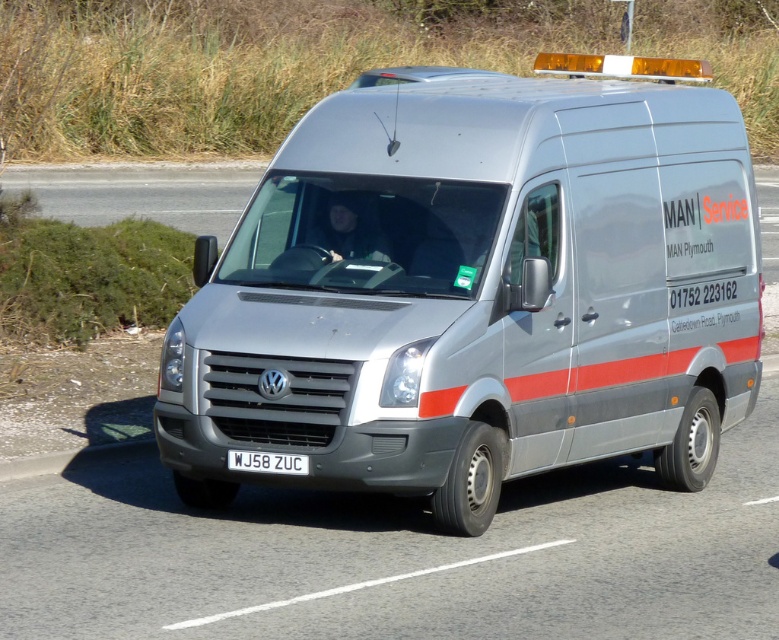
Question: Which point appears farthest from the camera in this image?

Choices:
 (A) (266, 465)
 (B) (566, 362)

Answer: (B)

Question: Can you confirm if satin silver van at center is thinner than white plastic license plate at center?

Choices:
 (A) no
 (B) yes

Answer: (A)

Question: Which point is closer to the camera taking this photo?

Choices:
 (A) (534, 433)
 (B) (273, 468)

Answer: (B)

Question: Is the position of satin silver van at center more distant than that of white plastic license plate at center?

Choices:
 (A) no
 (B) yes

Answer: (B)

Question: Can you confirm if satin silver van at center is wider than white plastic license plate at center?

Choices:
 (A) no
 (B) yes

Answer: (B)